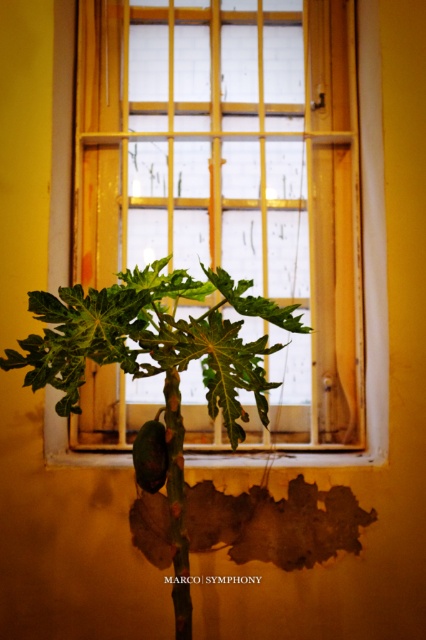
Question: Observing the image, what is the correct spatial positioning of green matte leafy plant at center in reference to wooden frame at center?

Choices:
 (A) right
 (B) left

Answer: (B)

Question: Is green matte leafy plant at center below wooden frame at center?

Choices:
 (A) yes
 (B) no

Answer: (A)

Question: Which point is closer to the camera?

Choices:
 (A) green matte leafy plant at center
 (B) wooden frame at center

Answer: (A)

Question: Which of the following is the farthest from the observer?

Choices:
 (A) wooden frame at center
 (B) green matte leafy plant at center

Answer: (A)

Question: Can you confirm if green matte leafy plant at center is positioned below wooden frame at center?

Choices:
 (A) yes
 (B) no

Answer: (A)

Question: Which of the following is the closest to the observer?

Choices:
 (A) green matte leafy plant at center
 (B) wooden frame at center

Answer: (A)